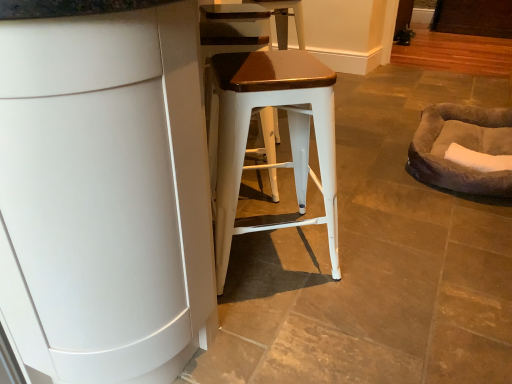
Identify the location of matte white stool at center. This screenshot has width=512, height=384. (289, 133).

Where is `brown fuzzy bean bag at right`? The height and width of the screenshot is (384, 512). brown fuzzy bean bag at right is located at coordinates (462, 145).

Measure the distance between brown fuzzy bean bag at right and camera.

brown fuzzy bean bag at right is 5.69 feet from camera.

Measure the distance between point (151, 87) and camera.

66.30 centimeters.

Find the location of `matte white stool at center`. matte white stool at center is located at coordinates (289, 133).

Is the depth of brown fuzzy bean bag at right greater than that of white matte cabinet at center?

Yes, brown fuzzy bean bag at right is further from the viewer.

Considering the positions of points (434, 151) and (138, 94), is point (434, 151) closer to camera compared to point (138, 94)?

No.

From the picture: Is brown fuzzy bean bag at right looking in the opposite direction of white matte cabinet at center?

That's not correct — brown fuzzy bean bag at right is not looking away from white matte cabinet at center.

Is brown fuzzy bean bag at right smaller than white matte cabinet at center?

Yes.

Based on their sizes in the image, would you say brown fuzzy bean bag at right is bigger or smaller than matte white stool at center?

Considering their sizes, brown fuzzy bean bag at right takes up less space than matte white stool at center.

From a real-world perspective, which is physically below, brown fuzzy bean bag at right or matte white stool at center?

In real-world perspective, brown fuzzy bean bag at right is lower.

Find the location of `stool above the brown fuzzy bean bag at right (from a real-world perspective)`. stool above the brown fuzzy bean bag at right (from a real-world perspective) is located at coordinates (289, 133).

Locate an element on the screen. Image resolution: width=512 pixels, height=384 pixels. cabinetry above the matte white stool at center (from a real-world perspective) is located at coordinates (105, 195).

From a real-world perspective, is white matte cabinet at center physically below matte white stool at center?

No, from a real-world perspective, white matte cabinet at center is not under matte white stool at center.

From the image's perspective, is white matte cabinet at center located above or below matte white stool at center?

From the image's perspective, white matte cabinet at center appears above matte white stool at center.

Is white matte cabinet at center taller or shorter than matte white stool at center?

In the image, white matte cabinet at center appears to be taller than matte white stool at center.

Is point (267, 58) positioned after point (179, 177)?

Yes, point (267, 58) is farther from viewer.

Does matte white stool at center touch white matte cabinet at center?

No, matte white stool at center is not next to white matte cabinet at center.

Does matte white stool at center lie in front of white matte cabinet at center?

No, matte white stool at center is behind white matte cabinet at center.

Is white matte cabinet at center a part of matte white stool at center?

No, white matte cabinet at center is located outside of matte white stool at center.

Considering the relative sizes of matte white stool at center and brown fuzzy bean bag at right in the image provided, is matte white stool at center bigger than brown fuzzy bean bag at right?

Yes.

From a real-world perspective, is matte white stool at center physically located above or below brown fuzzy bean bag at right?

matte white stool at center is above brown fuzzy bean bag at right.

Is matte white stool at center far away from brown fuzzy bean bag at right?

Actually, matte white stool at center and brown fuzzy bean bag at right are a little close together.

Looking at this image, is matte white stool at center situated inside brown fuzzy bean bag at right or outside?

matte white stool at center lies outside brown fuzzy bean bag at right.

Is white matte cabinet at center taller or shorter than brown fuzzy bean bag at right?

In the image, white matte cabinet at center appears to be taller than brown fuzzy bean bag at right.

Considering the sizes of objects white matte cabinet at center and brown fuzzy bean bag at right in the image provided, who is wider, white matte cabinet at center or brown fuzzy bean bag at right?

With larger width is white matte cabinet at center.

Does white matte cabinet at center appear on the right side of brown fuzzy bean bag at right?

In fact, white matte cabinet at center is to the left of brown fuzzy bean bag at right.

The width and height of the screenshot is (512, 384). In order to click on cabinetry in front of the brown fuzzy bean bag at right in this screenshot , I will do `click(105, 195)`.

Where is `bean bag chair located above the matte white stool at center (from the image's perspective)`? This screenshot has width=512, height=384. bean bag chair located above the matte white stool at center (from the image's perspective) is located at coordinates (462, 145).

From the image, which object appears to be farther from brown fuzzy bean bag at right, white matte cabinet at center or matte white stool at center?

white matte cabinet at center is positioned further to the anchor brown fuzzy bean bag at right.

Looking at the image, which one is located closer to white matte cabinet at center, brown fuzzy bean bag at right or matte white stool at center?

matte white stool at center is positioned closer to the anchor white matte cabinet at center.

When comparing their distances from white matte cabinet at center, does matte white stool at center or brown fuzzy bean bag at right seem further?

Based on the image, brown fuzzy bean bag at right appears to be further to white matte cabinet at center.

Consider the image. When comparing their distances from matte white stool at center, does white matte cabinet at center or brown fuzzy bean bag at right seem closer?

Based on the image, white matte cabinet at center appears to be nearer to matte white stool at center.

When comparing their distances from brown fuzzy bean bag at right, does matte white stool at center or white matte cabinet at center seem further?

white matte cabinet at center.

Consider the image. When comparing their distances from matte white stool at center, does brown fuzzy bean bag at right or white matte cabinet at center seem further?

The object further to matte white stool at center is brown fuzzy bean bag at right.

I want to click on stool located between white matte cabinet at center and brown fuzzy bean bag at right in the left-right direction, so click(x=289, y=133).